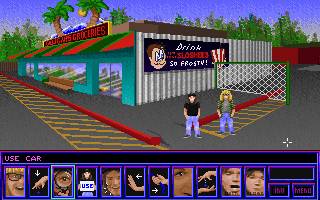
You are a GUI agent. You are given a task and a screenshot of the screen. Output one action in this format:
    pyautogui.click(x=<x>, y=<y>)
    Task: Click on the bench
    Image resolution: width=320 pixels, height=200 pixels.
    Given the screenshot: What is the action you would take?
    pyautogui.click(x=60, y=86)